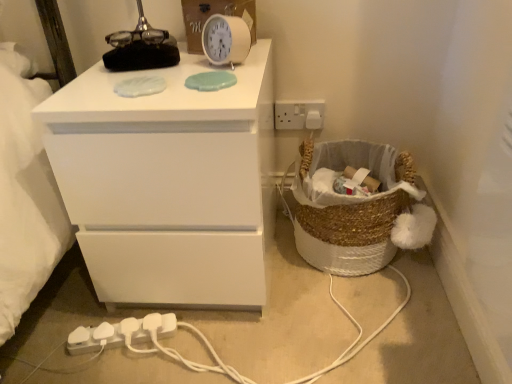
Question: Is white plastic extension cord at lower left aimed at white plastic electrical outlet at upper right?

Choices:
 (A) no
 (B) yes

Answer: (A)

Question: Considering the relative sizes of white plastic extension cord at lower left and white plastic electrical outlet at upper right in the image provided, is white plastic extension cord at lower left shorter than white plastic electrical outlet at upper right?

Choices:
 (A) no
 (B) yes

Answer: (B)

Question: Does white plastic extension cord at lower left have a smaller size compared to white plastic electrical outlet at upper right?

Choices:
 (A) yes
 (B) no

Answer: (B)

Question: Does white plastic extension cord at lower left have a lesser width compared to white plastic electrical outlet at upper right?

Choices:
 (A) no
 (B) yes

Answer: (A)

Question: Is white plastic extension cord at lower left in contact with white plastic electrical outlet at upper right?

Choices:
 (A) no
 (B) yes

Answer: (A)

Question: From a real-world perspective, is white plastic extension cord at lower left under white plastic electrical outlet at upper right?

Choices:
 (A) no
 (B) yes

Answer: (B)

Question: Can you confirm if white matte chest of drawers at upper left is wider than white plastic extension cord at lower left?

Choices:
 (A) yes
 (B) no

Answer: (A)

Question: Considering the relative sizes of white matte chest of drawers at upper left and white plastic extension cord at lower left in the image provided, is white matte chest of drawers at upper left thinner than white plastic extension cord at lower left?

Choices:
 (A) no
 (B) yes

Answer: (A)

Question: Is white matte chest of drawers at upper left with white plastic extension cord at lower left?

Choices:
 (A) no
 (B) yes

Answer: (A)

Question: Is white matte chest of drawers at upper left at the left side of white plastic extension cord at lower left?

Choices:
 (A) no
 (B) yes

Answer: (A)

Question: Is white plastic extension cord at lower left located within white matte chest of drawers at upper left?

Choices:
 (A) yes
 (B) no

Answer: (B)

Question: Could you tell me if white matte chest of drawers at upper left is facing white plastic extension cord at lower left?

Choices:
 (A) no
 (B) yes

Answer: (B)

Question: Does braided wicker basket at lower right have a lesser width compared to white matte chest of drawers at upper left?

Choices:
 (A) yes
 (B) no

Answer: (A)